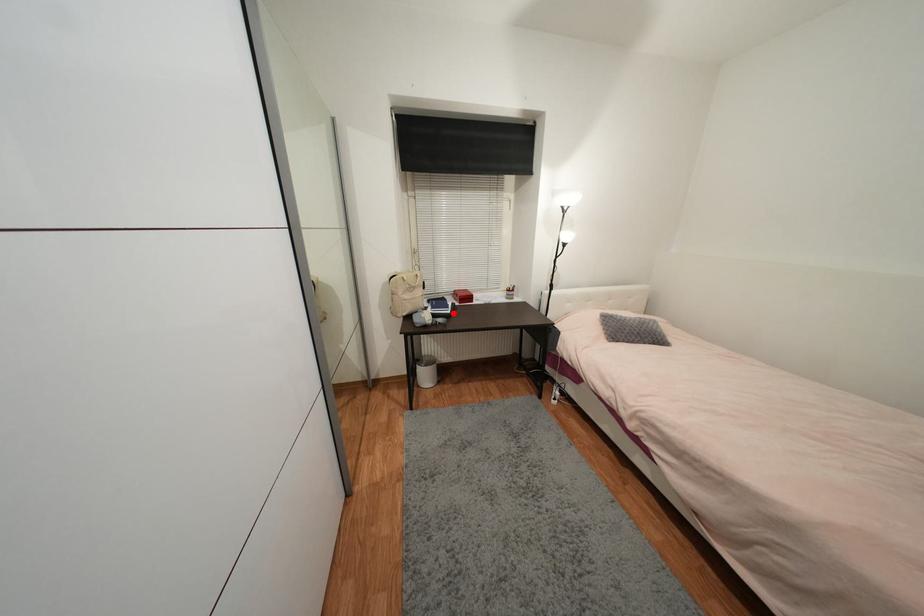
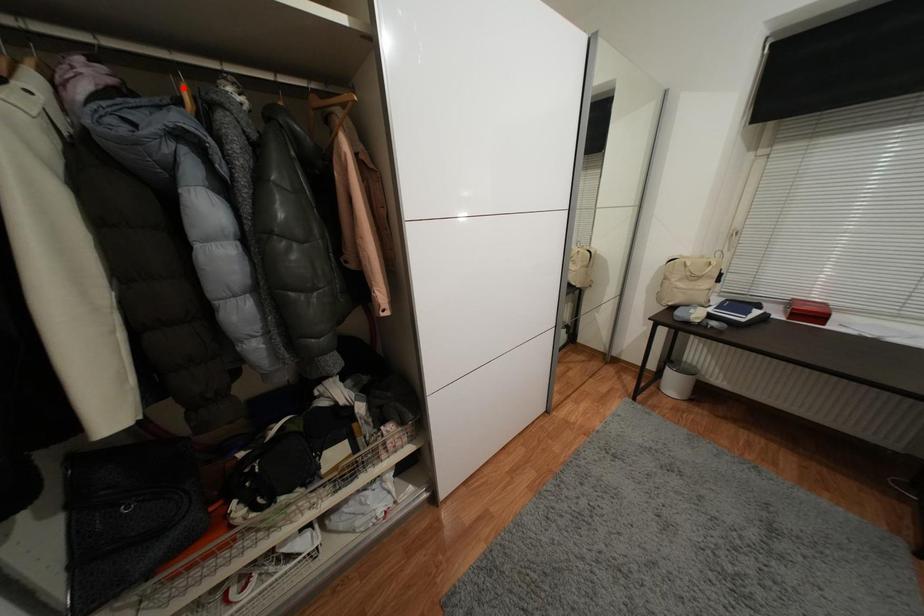
I am providing you with two images of the same scene from different viewpoints. A red point is marked on the first image and another point is marked on the second image. Do the highlighted points in image1 and image2 indicate the same real-world spot?

No